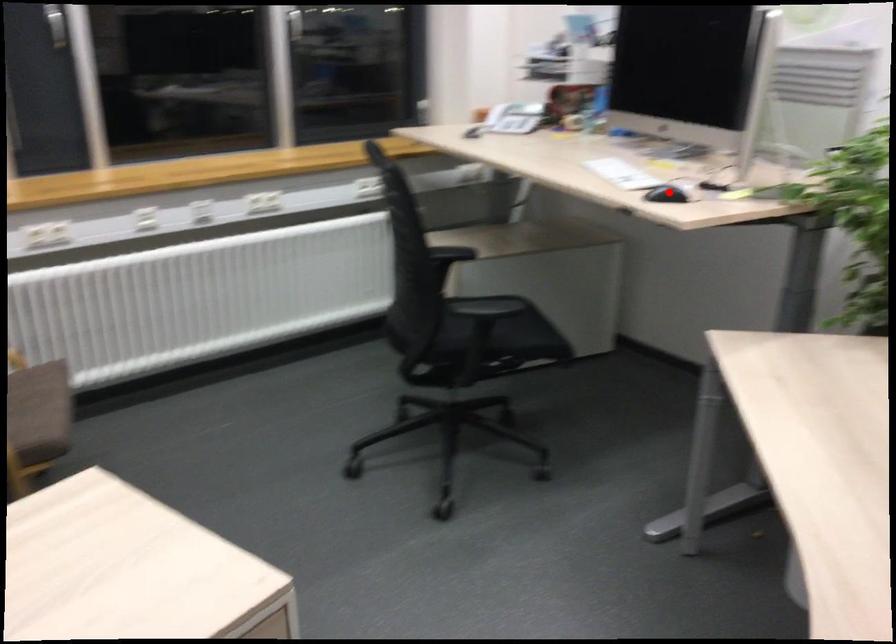
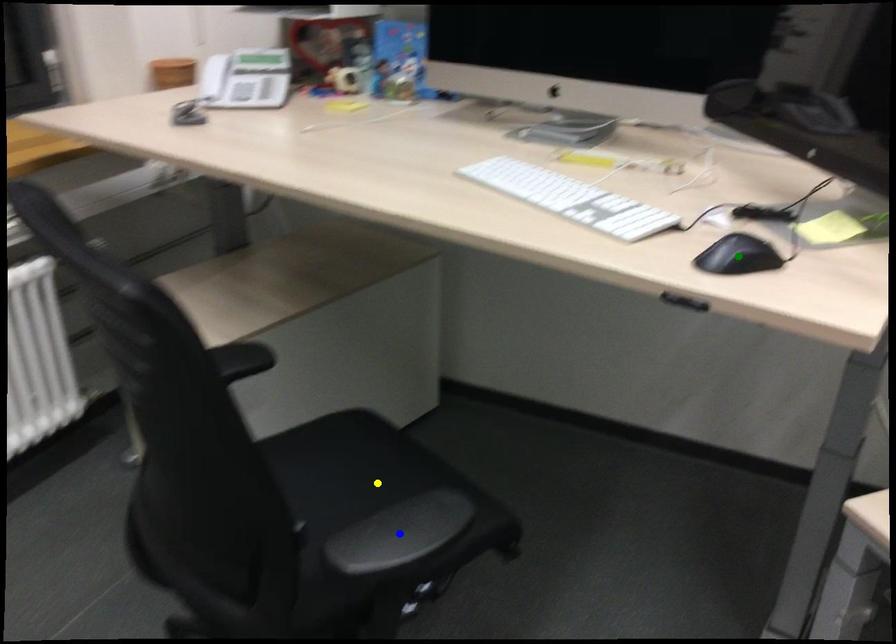
Question: I am providing you with two images of the same scene from different viewpoints. A red point is marked on the first image. You are given multiple points on the second image. Which point in image 2 is actually the same real-world point as the red point in image 1?

Choices:
 (A) blue point
 (B) green point
 (C) yellow point

Answer: (B)